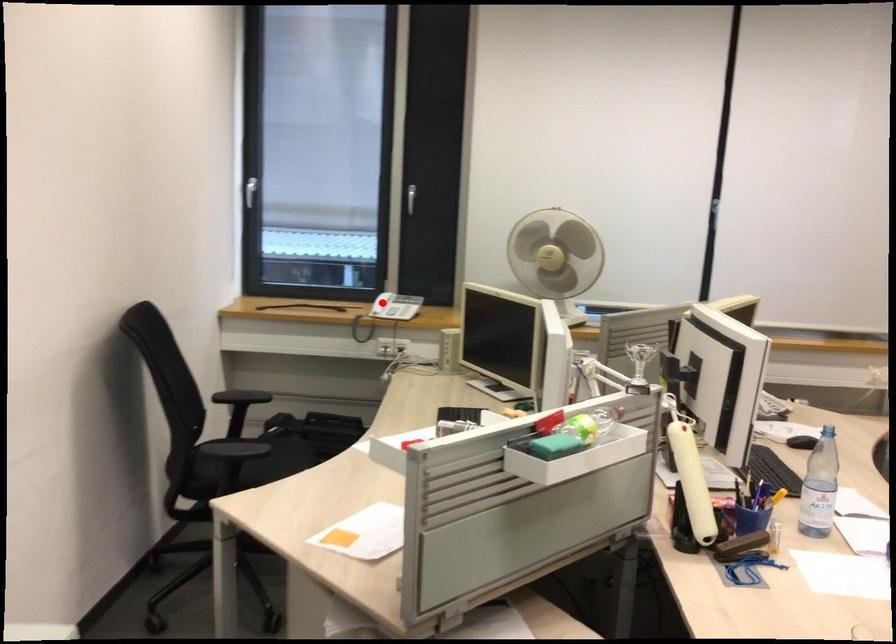
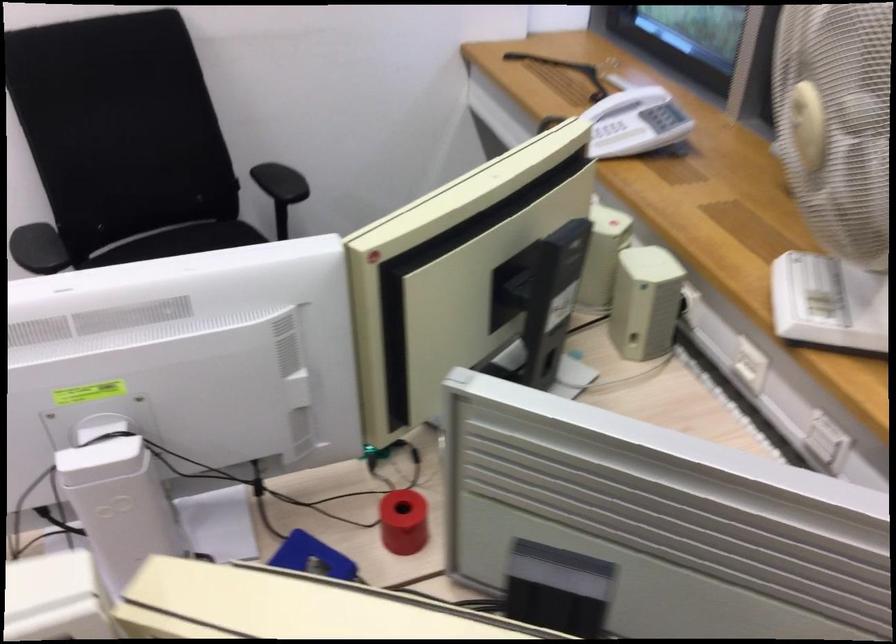
In the second image, find the point that corresponds to the highlighted location in the first image.

(612, 131)